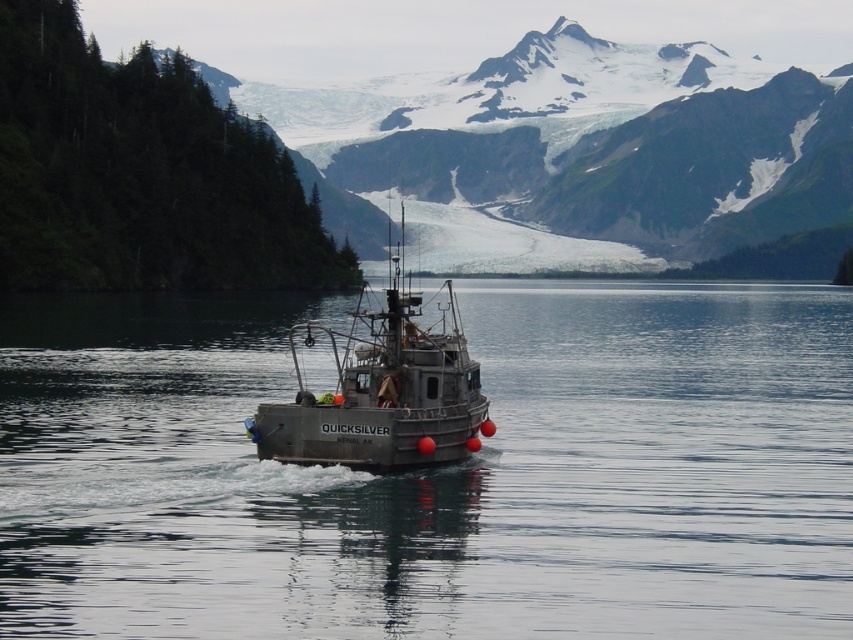
Question: Considering the relative positions of clear water at center and gray metallic fishing boat at center in the image provided, where is clear water at center located with respect to gray metallic fishing boat at center?

Choices:
 (A) left
 (B) right

Answer: (B)

Question: Which object appears closest to the camera in this image?

Choices:
 (A) snowy granite mountain at upper center
 (B) clear water at center
 (C) gray metallic fishing boat at center

Answer: (B)

Question: Which point is closer to the camera?

Choices:
 (A) (648, 173)
 (B) (393, 458)

Answer: (B)

Question: Among these objects, which one is nearest to the camera?

Choices:
 (A) clear water at center
 (B) snowy granite mountain at upper center
 (C) gray metallic fishing boat at center

Answer: (A)

Question: Is the position of clear water at center more distant than that of gray metallic fishing boat at center?

Choices:
 (A) yes
 (B) no

Answer: (B)

Question: Is snowy granite mountain at upper center bigger than gray metallic fishing boat at center?

Choices:
 (A) no
 (B) yes

Answer: (B)